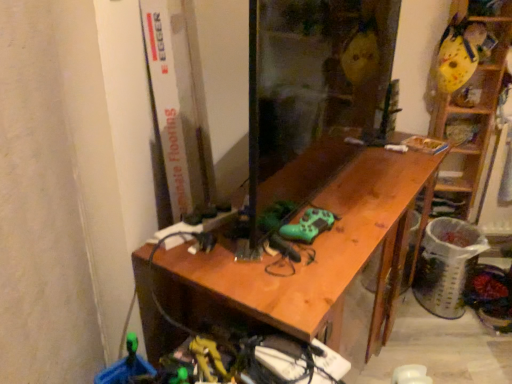
Question: Would you say wooden desk at center is to the left or to the right of wooden at right in the picture?

Choices:
 (A) right
 (B) left

Answer: (B)

Question: From a real-world perspective, is wooden desk at center positioned above or below wooden at right?

Choices:
 (A) above
 (B) below

Answer: (B)

Question: From the image's perspective, is wooden desk at center located above or below wooden at right?

Choices:
 (A) above
 (B) below

Answer: (B)

Question: From a real-world perspective, is wooden at right above or below wooden desk at center?

Choices:
 (A) above
 (B) below

Answer: (A)

Question: Is wooden at right inside or outside of wooden desk at center?

Choices:
 (A) outside
 (B) inside

Answer: (A)

Question: Would you say wooden at right is to the left or to the right of wooden desk at center in the picture?

Choices:
 (A) right
 (B) left

Answer: (A)

Question: Looking at their shapes, would you say wooden at right is wider or thinner than wooden desk at center?

Choices:
 (A) thin
 (B) wide

Answer: (A)